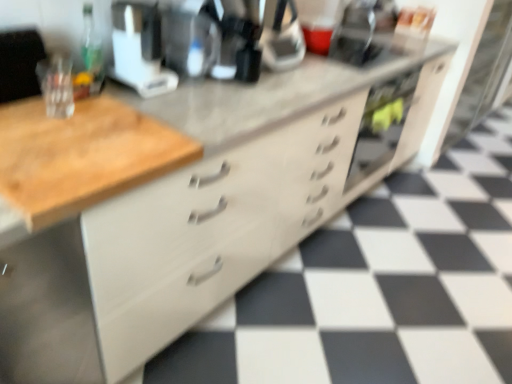
I want to click on free spot in front of black plastic coffee machine at center, so click(x=230, y=95).